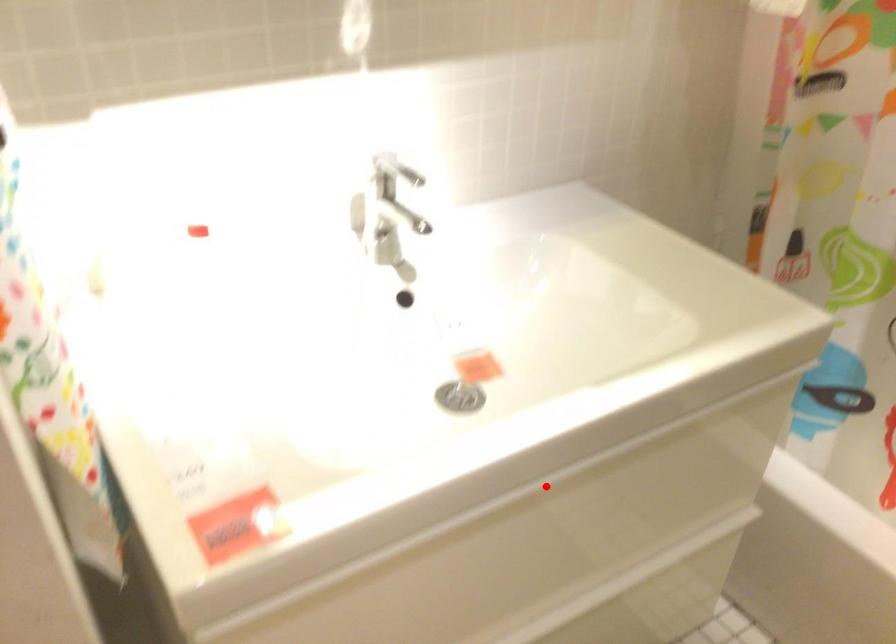
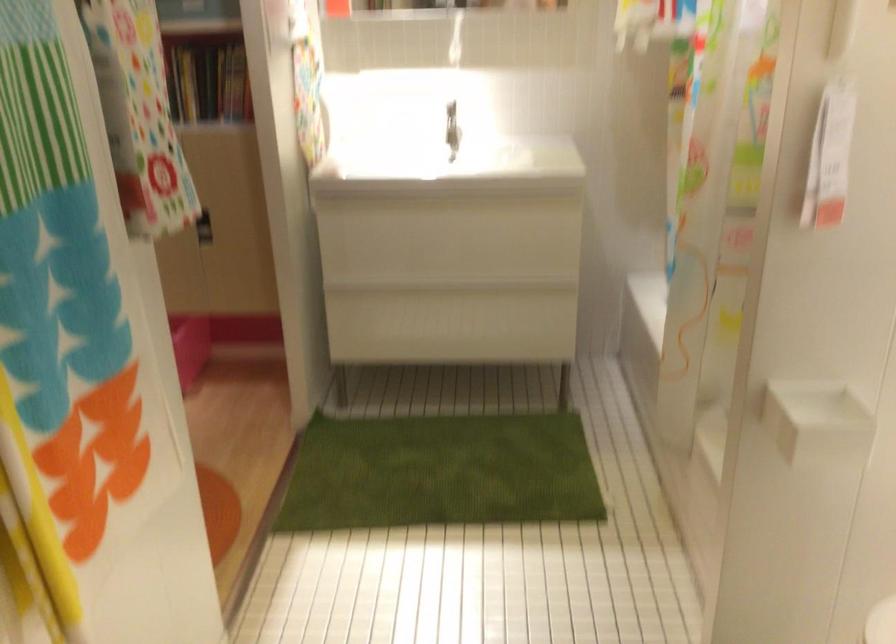
Question: I am providing you with two images of the same scene from different viewpoints. A red point is shown in image1. For the corresponding object point in image2, is it positioned nearer or farther from the camera?

Choices:
 (A) Nearer
 (B) Farther

Answer: (B)